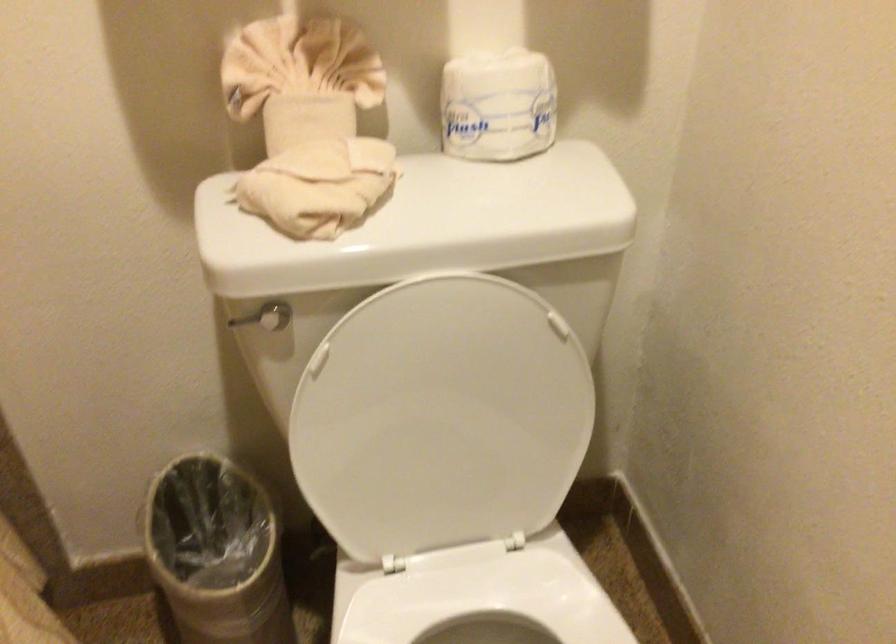
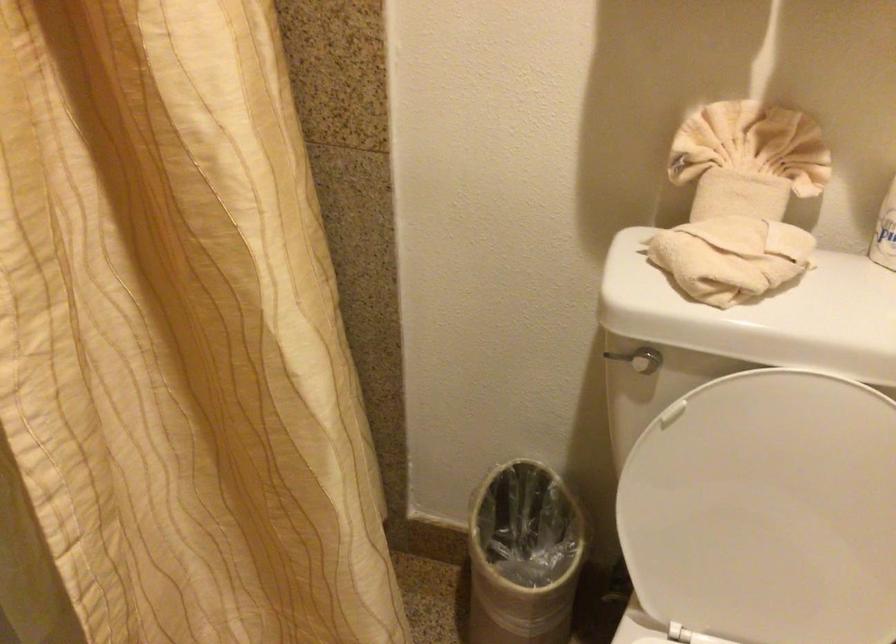
Where in the second image is the point corresponding to pixel 325 185 from the first image?

(730, 257)